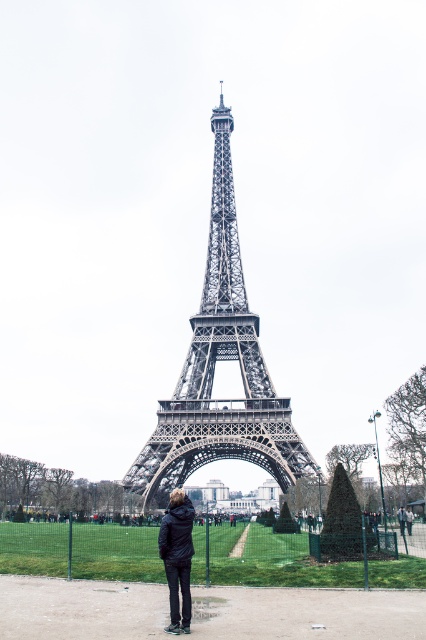
Based on the photo, you are standing at the base of the Eiffel Tower and want to take a photo of the metallic structure at center and the green grass at lower center. Which object should you focus on first to ensure it appears sharp in your photo?

You should focus on the metallic structure at center first because it is closer to the viewer than the green grass at lower center. Since it is nearer, focusing on it will keep it sharp while the background grass may appear slightly blurred, which is common in photography when the depth of field is shallow.

You are a tourist at the Eiffel Tower and want to take a photo of the metallic structure at center and the green grass at lower center. Which object should you focus on first if you want to capture both in a single frame without moving the camera?

The metallic structure at center is bigger than the green grass at lower center, so you should focus on the metallic structure at center first to ensure it fills the frame appropriately while still capturing the smaller green grass at lower center in the background.